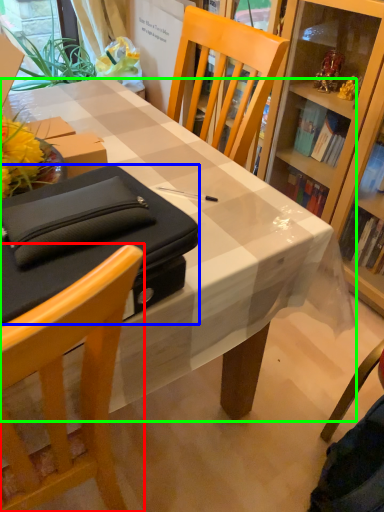
Question: Based on their relative distances, which object is nearer to chair (highlighted by a red box)? Choose from box (highlighted by a blue box) and desk (highlighted by a green box).

Choices:
 (A) box
 (B) desk

Answer: (A)